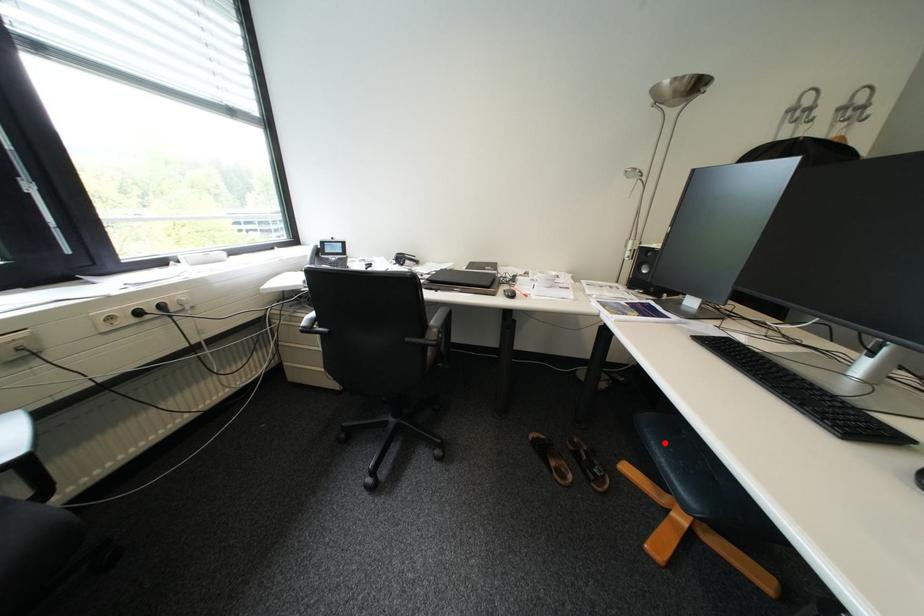
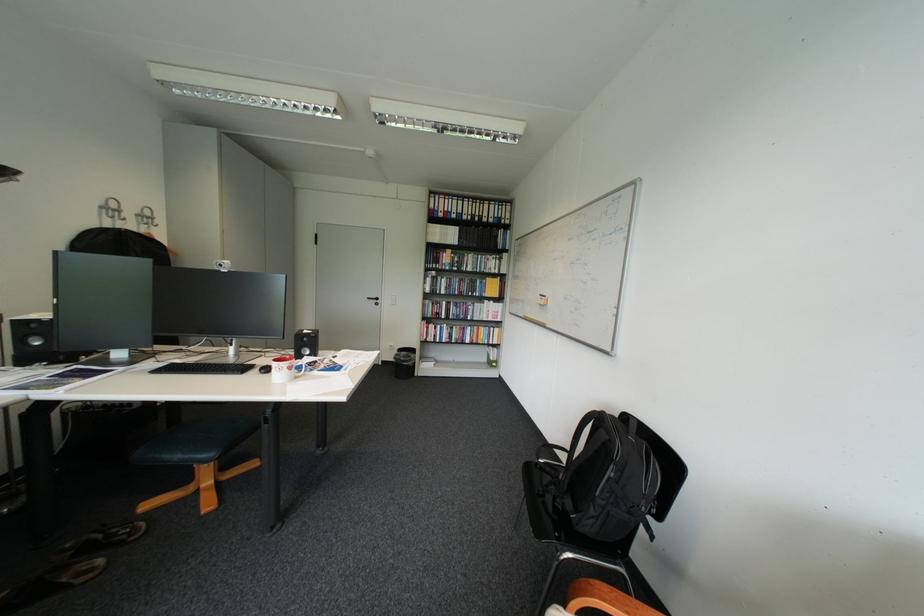
Locate, in the second image, the point that corresponds to the highlighted location in the first image.

(176, 456)